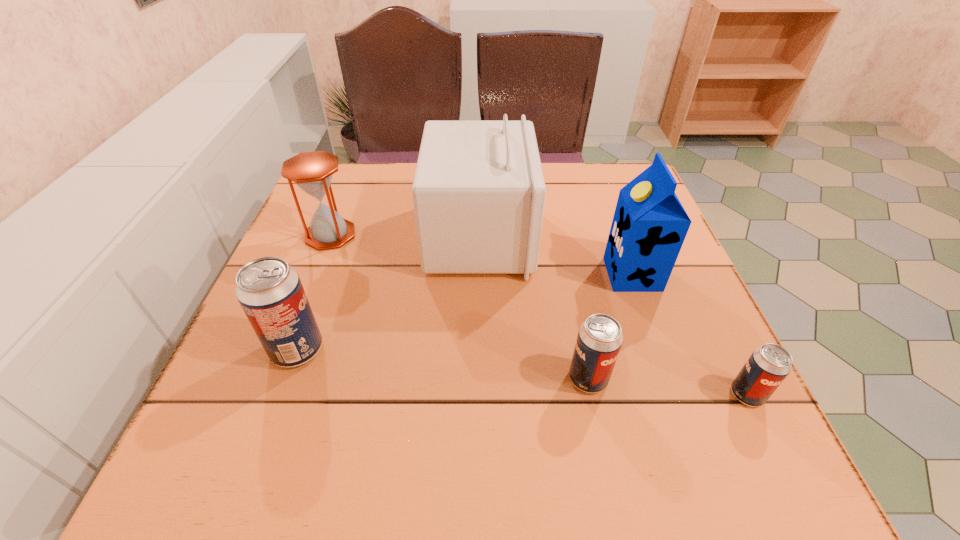
Locate an element on the screen. blank space located on the left of the shortest object is located at coordinates (540, 394).

The height and width of the screenshot is (540, 960). I want to click on vacant space located with the cap open on the second object from right to left, so click(x=472, y=274).

Where is `vacant area situated 0.260m with the cap open on the second object from right to left`? vacant area situated 0.260m with the cap open on the second object from right to left is located at coordinates (487, 274).

Identify the location of free location located 0.280m with the cap open on the second object from right to left. The height and width of the screenshot is (540, 960). (477, 274).

At what (x,y) coordinates should I click in order to perform the action: click on vacant area situated 0.260m on the front-facing side of the fourth object from right to left. Please return your answer as a coordinate pair (x, y). This screenshot has height=540, width=960. Looking at the image, I should click on (641, 237).

This screenshot has height=540, width=960. Identify the location of vacant space situated on the right of the hourglass. (465, 235).

This screenshot has height=540, width=960. What are the coordinates of `object positioned at the far edge` in the screenshot? It's located at (478, 193).

Identify the location of beer can at the left edge. The height and width of the screenshot is (540, 960). (270, 292).

Where is `hourglass present at the left edge`? This screenshot has width=960, height=540. hourglass present at the left edge is located at coordinates (312, 171).

This screenshot has height=540, width=960. I want to click on beer can that is at the right edge, so click(x=767, y=367).